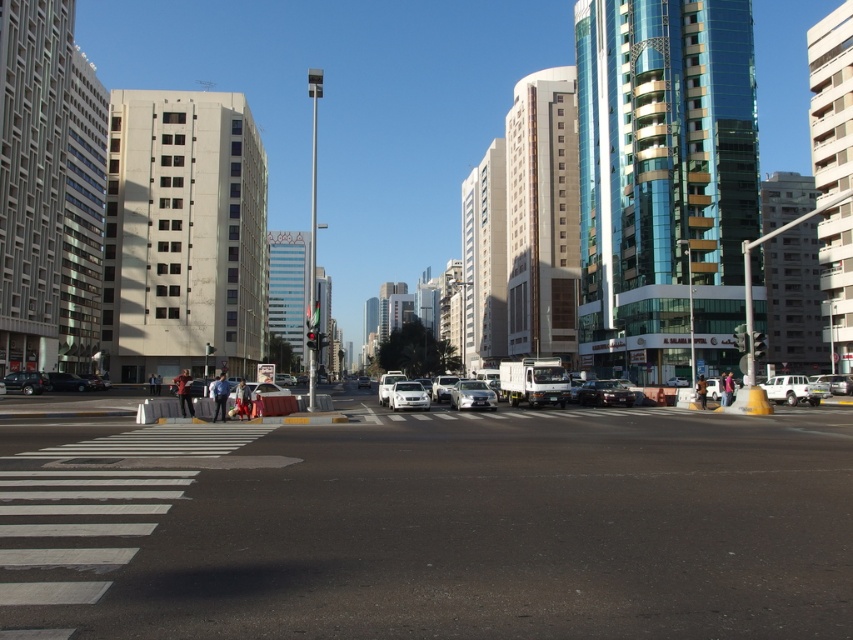
You are a pedestrian standing at the edge of the road and see both the matte black car at lower left and the shiny black sedan at lower left. Which one is positioned more to the left side of the road?

The matte black car at lower left is positioned more to the left side of the road compared to the shiny black sedan at lower left.

You are a delivery person needing to cross the black asphalt road at center. The shiny black sedan at center is parked in the middle. Can you safely walk around it without stepping onto the road?

The black asphalt road at center is wider than the shiny black sedan at center, so there should be enough space to walk around the parked car without stepping onto the road.